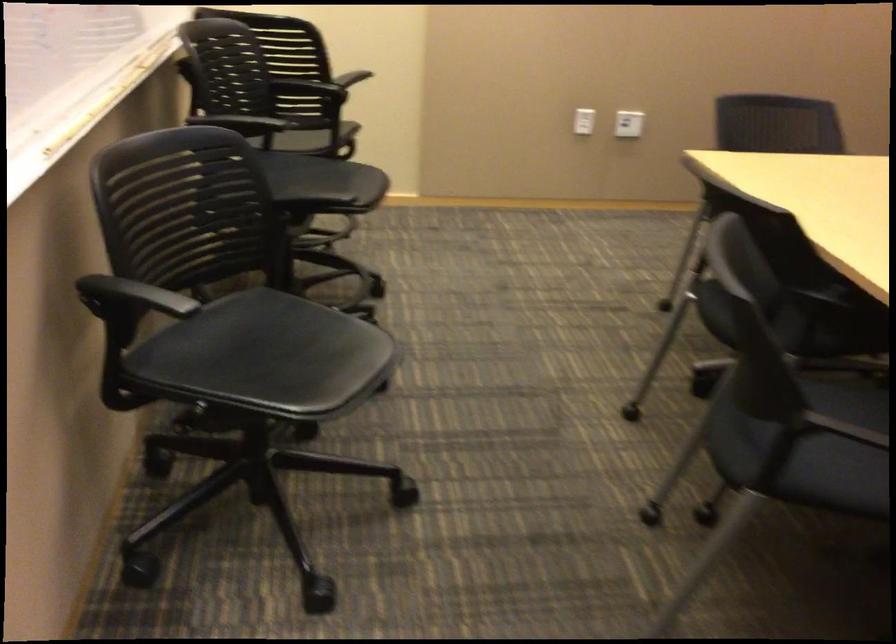
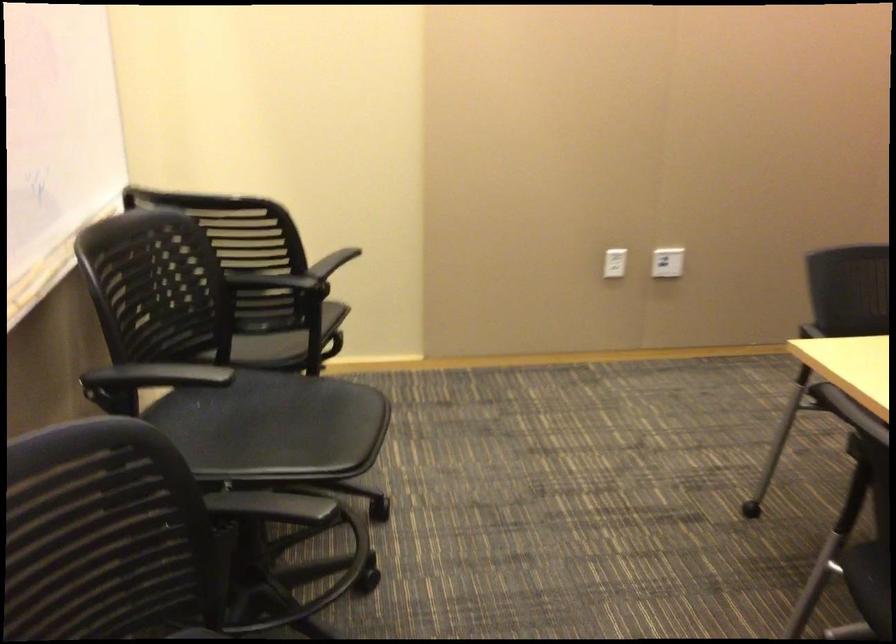
Question: How did the camera likely rotate?

Choices:
 (A) Left
 (B) Right
 (C) Up
 (D) Down

Answer: (C)